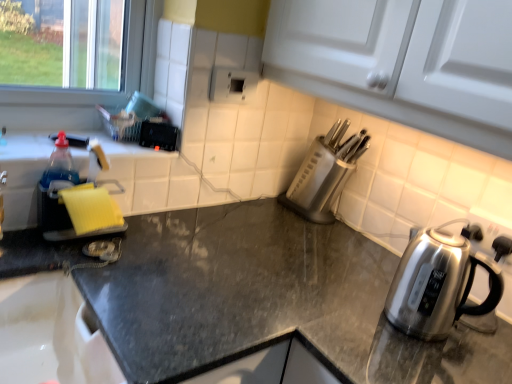
At what (x,y) coordinates should I click in order to perform the action: click on vacant space positioned to the left of satin silver knife block at center-right. Please return your answer as a coordinate pair (x, y). Image resolution: width=512 pixels, height=384 pixels. Looking at the image, I should click on (250, 212).